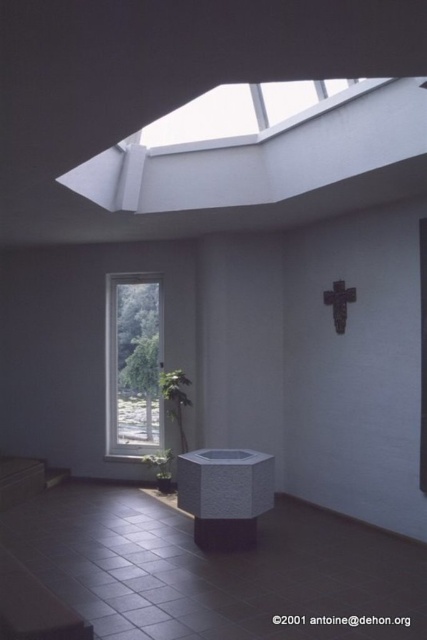
Question: Is clear glass window at center to the left of transparent glass skylight at upper center from the viewer's perspective?

Choices:
 (A) yes
 (B) no

Answer: (A)

Question: Does clear glass window at center come behind transparent glass skylight at upper center?

Choices:
 (A) yes
 (B) no

Answer: (A)

Question: Is clear glass window at center bigger than transparent glass skylight at upper center?

Choices:
 (A) yes
 (B) no

Answer: (B)

Question: Which point is farther to the camera?

Choices:
 (A) pos(342,90)
 (B) pos(154,276)

Answer: (B)

Question: Which object is closer to the camera taking this photo?

Choices:
 (A) clear glass window at center
 (B) transparent glass skylight at upper center

Answer: (B)